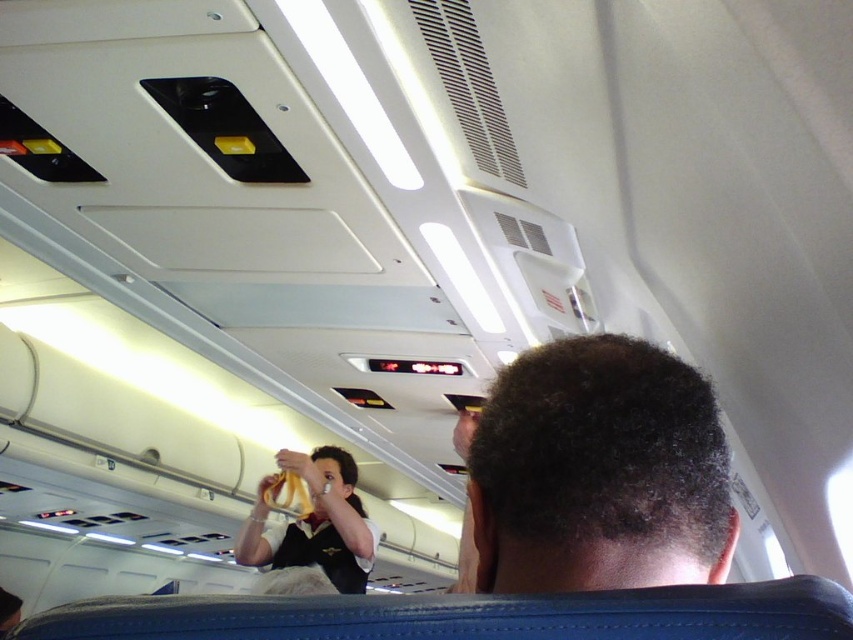
You are a passenger sitting in the window seat of an airplane cabin. You notice two items in your line of sight at the center of the scene. One is the dark curly hair at center and the other is the white uniform at center. Which of these two items appears narrower?

The dark curly hair at center appears narrower than the white uniform at center because it has a lesser width compared to the white uniform at center.

From the picture: You are a flight attendant trying to locate a passenger in the airplane cabin. You see the dark curly hair at center and the white uniform at center. Which one is closer to you?

The dark curly hair at center is closer to you because it is smaller than the white uniform at center, indicating it is farther away.

You are a passenger seated at the window seat in an airplane cabin. You notice a point marked at coordinates point (625, 353) in your field of view. If your arm can reach 22 inches, can you comfortably touch that point?

The point (625, 353) is 20.71 inches away from the camera, so yes, you can comfortably touch it since your arm can reach 22 inches.